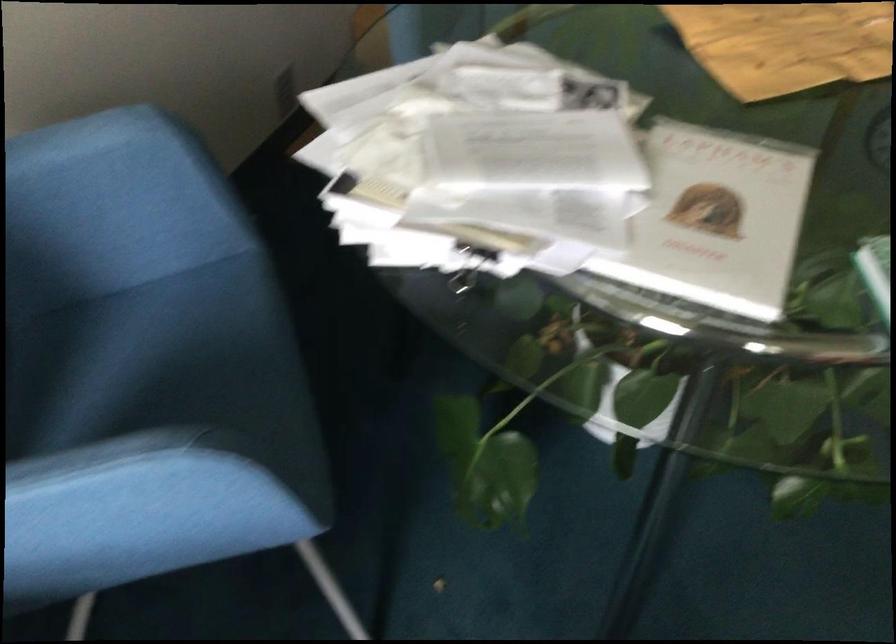
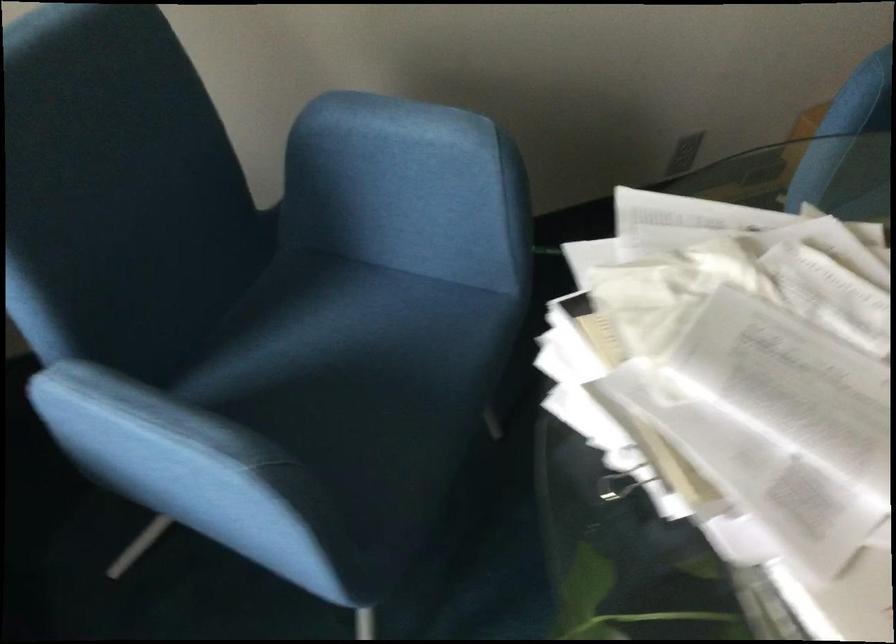
In the second image, find the point that corresponds to point (128, 375) in the first image.

(328, 342)